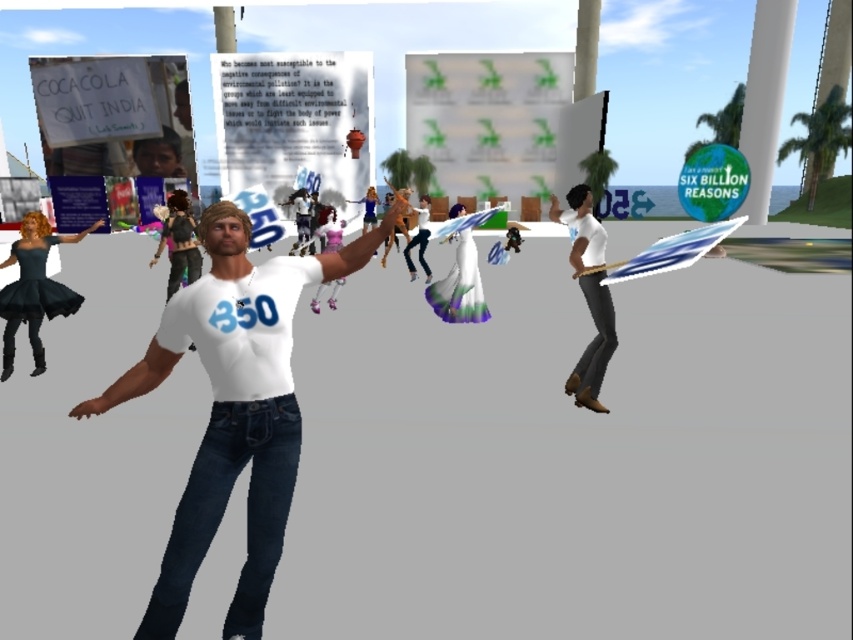
Question: Which point is closer to the camera?

Choices:
 (A) (426, 262)
 (B) (178, 193)

Answer: (B)

Question: Is black leather jacket at center further to camera compared to matte purple dress at center?

Choices:
 (A) no
 (B) yes

Answer: (B)

Question: Is matte purple dress at center to the right of white matte shirt at center from the viewer's perspective?

Choices:
 (A) yes
 (B) no

Answer: (B)

Question: Does white matte t-shirt at center come behind matte purple dress at center?

Choices:
 (A) no
 (B) yes

Answer: (A)

Question: Which of these objects is positioned farthest from the matte black dress at lower left?

Choices:
 (A) matte purple dress at center
 (B) matte white shirt at right
 (C) white matte shirt at center
 (D) black leather jacket at center

Answer: (C)

Question: Which is farther from the matte white shirt at right?

Choices:
 (A) black leather jacket at center
 (B) matte purple dress at center
 (C) matte black dress at lower left

Answer: (C)